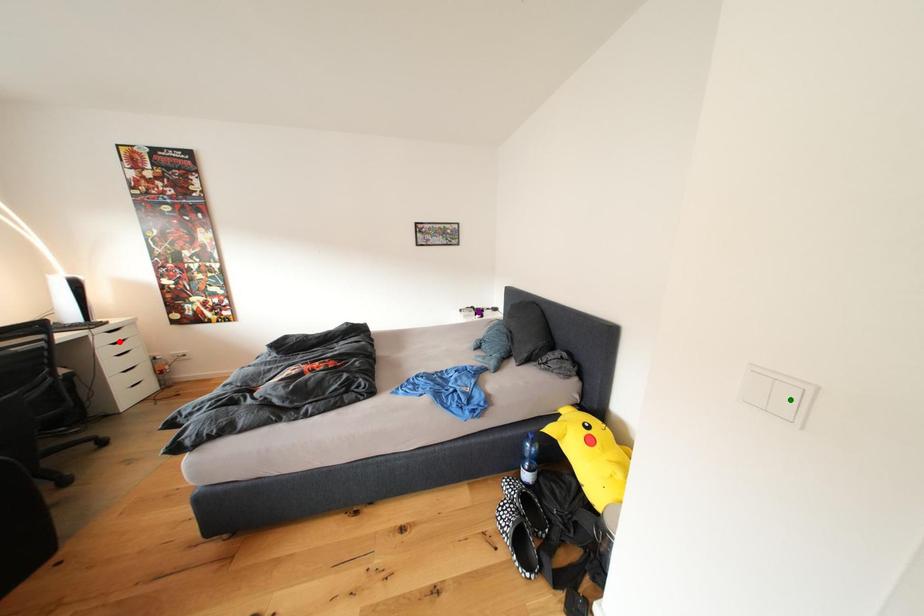
Order these from nearest to farthest:
A) purple point
B) green point
C) red point

green point, red point, purple point